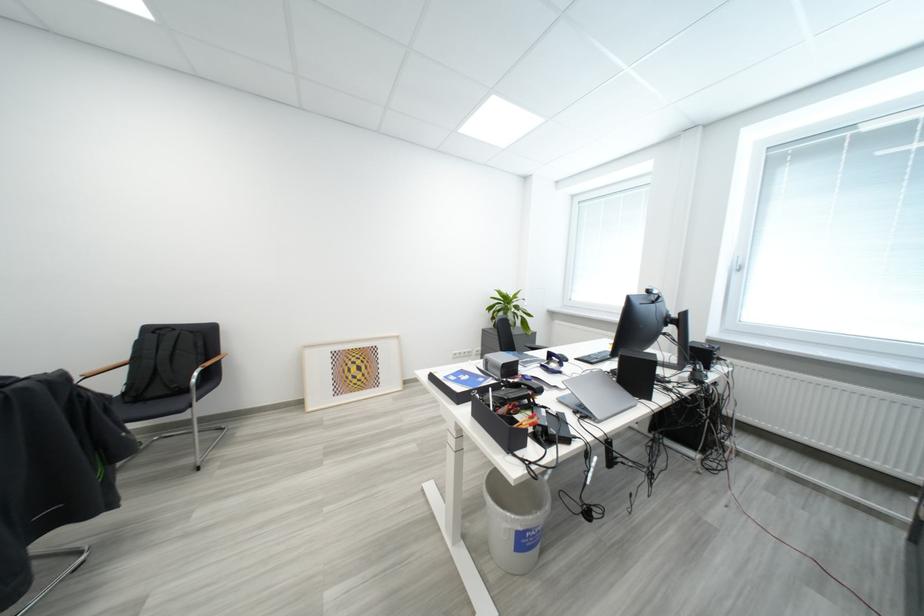
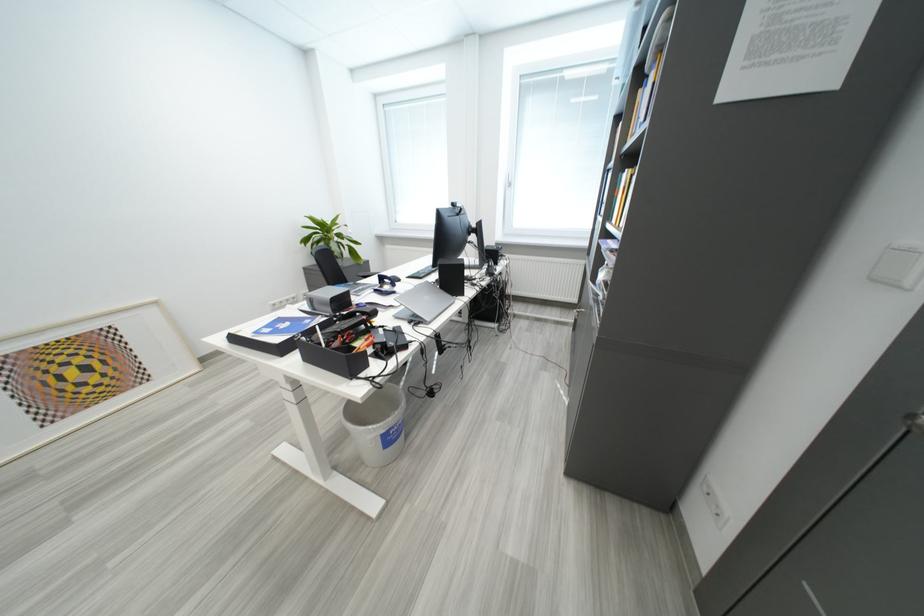
Where in the second image is the point corresponding to (490,382) from the first image?

(317, 323)